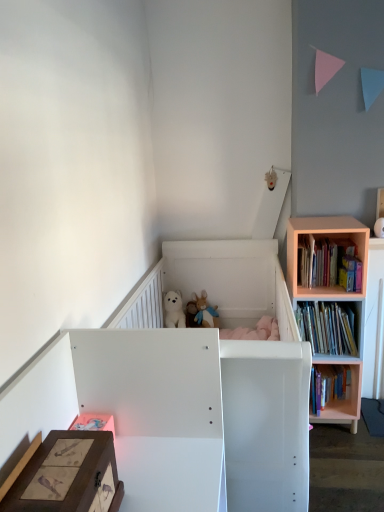
The image size is (384, 512). Describe the element at coordinates (174, 310) in the screenshot. I see `white plush bear at upper center` at that location.

This screenshot has width=384, height=512. What are the coordinates of `wooden bookshelf at right, the 1th book from the top` in the screenshot? It's located at (329, 263).

What do you see at coordinates (332, 300) in the screenshot? The height and width of the screenshot is (512, 384). I see `pink wood bookshelf at right` at bounding box center [332, 300].

The height and width of the screenshot is (512, 384). What do you see at coordinates (329, 386) in the screenshot?
I see `hardcover book at right, arranged as the third book when viewed from the top` at bounding box center [329, 386].

The width and height of the screenshot is (384, 512). Identify the location of matte white vase at upper right, which is the 1th toy from right to left. (379, 227).

Identify the location of white matte infant bed at center. This screenshot has width=384, height=512. (185, 388).

Is white plush bear at upper center behind wooden bookshelf at right, the 1th book from the top?

Yes, white plush bear at upper center is further from the viewer.

Is white plush bear at upper center not within wooden bookshelf at right, the 1th book from the top?

Indeed, white plush bear at upper center is completely outside wooden bookshelf at right, the 1th book from the top.

From the image's perspective, between white plush bear at upper center and wooden bookshelf at right, positioned as the 3th book in bottom-to-top order, who is located below?

white plush bear at upper center appears lower in the image.

Considering the sizes of objects white plush bear at upper center and wooden bookshelf at right, positioned as the 3th book in bottom-to-top order, in the image provided, who is shorter, white plush bear at upper center or wooden bookshelf at right, positioned as the 3th book in bottom-to-top order,?

white plush bear at upper center.

Is wooden bookshelf at right, positioned as the 3th book in bottom-to-top order, positioned with its back to white matte infant bed at center?

wooden bookshelf at right, positioned as the 3th book in bottom-to-top order, is not turned away from white matte infant bed at center.

Which is more to the left, wooden bookshelf at right, the 1th book from the top, or white matte infant bed at center?

Positioned to the left is white matte infant bed at center.

Is wooden bookshelf at right, the 1th book from the top, positioned in front of white matte infant bed at center?

No, wooden bookshelf at right, the 1th book from the top, is further to the viewer.

Is wooden bookshelf at right, the 1th book from the top, located outside white matte infant bed at center?

Absolutely, wooden bookshelf at right, the 1th book from the top, is external to white matte infant bed at center.

Is white matte infant bed at center not close to wooden storage box at lower left?

No, white matte infant bed at center is not far from wooden storage box at lower left.

Is white matte infant bed at center thinner than wooden storage box at lower left?

No.

How many degrees apart are the facing directions of white matte infant bed at center and wooden storage box at lower left?

They differ by 0.506 degrees in their facing directions.

Considering the positions of points (336, 266) and (380, 233), is point (336, 266) farther from camera compared to point (380, 233)?

No, it is not.

Is wooden bookshelf at right, positioned as the 3th book in bottom-to-top order, taller than matte white vase at upper right, the first toy from the front?

Yes.

Is wooden bookshelf at right, positioned as the 3th book in bottom-to-top order, beside matte white vase at upper right, the first toy from the front?

No, wooden bookshelf at right, positioned as the 3th book in bottom-to-top order, is not beside matte white vase at upper right, the first toy from the front.

Is matte white vase at upper right, which ranks as the 1th toy in top-to-bottom order, at the back of wooden bookshelf at right, the 1th book from the top?

That's not correct — wooden bookshelf at right, the 1th book from the top, is not looking away from matte white vase at upper right, which ranks as the 1th toy in top-to-bottom order.

From the image's perspective, which is above, matte white vase at upper right, positioned as the second toy in bottom-to-top order, or wooden storage box at lower left?

matte white vase at upper right, positioned as the second toy in bottom-to-top order, appears higher in the image.

Is matte white vase at upper right, marked as the second toy in a left-to-right arrangement, shorter than wooden storage box at lower left?

Yes.

In the scene shown: Is wooden bookshelf at right, the 1th book from the top, in front of white plush bear at upper center?

Yes, wooden bookshelf at right, the 1th book from the top, is closer to the viewer.

Considering the sizes of wooden bookshelf at right, the 1th book from the top, and white plush bear at upper center in the image, is wooden bookshelf at right, the 1th book from the top, wider or thinner than white plush bear at upper center?

In the image, wooden bookshelf at right, the 1th book from the top, appears to be wider than white plush bear at upper center.

From a real-world perspective, does wooden bookshelf at right, the 1th book from the top, stand above white plush bear at upper center?

Yes.

From the image's perspective, is wooden bookshelf at right, the 1th book from the top, below white plush bear at upper center?

No.

Considering the relative sizes of hardcover book at right, arranged as the third book when viewed from the top, and white matte infant bed at center in the image provided, is hardcover book at right, arranged as the third book when viewed from the top, thinner than white matte infant bed at center?

Yes.

From a real-world perspective, between hardcover book at right, the 1th book from the bottom, and white matte infant bed at center, who is vertically higher?

white matte infant bed at center.

Consider the image. Is the position of hardcover book at right, arranged as the third book when viewed from the top, less distant than that of white matte infant bed at center?

No, hardcover book at right, arranged as the third book when viewed from the top, is further to the viewer.

Is hardcover book at right, the 1th book from the bottom, positioned far away from white matte infant bed at center?

Absolutely, hardcover book at right, the 1th book from the bottom, is distant from white matte infant bed at center.

Image resolution: width=384 pixels, height=512 pixels. I want to click on book that is the 2nd object above the white plush bear at upper center (from a real-world perspective), so click(x=329, y=263).

The width and height of the screenshot is (384, 512). I want to click on infant bed on the left of wooden bookshelf at right, positioned as the 3th book in bottom-to-top order, so click(185, 388).

When comparing their distances from hardcover book at right, arranged as the third book when viewed from the top, does wooden bookshelf at right, the 1th book from the top, or matte white vase at upper right, positioned as the second toy in bottom-to-top order, seem further?

matte white vase at upper right, positioned as the second toy in bottom-to-top order, lies further to hardcover book at right, arranged as the third book when viewed from the top, than the other object.

Looking at the image, which one is located further to wooden bookshelf at right, the 1th book from the top, white plush bear at upper center or fluffy plush toys at center, the first toy when ordered from left to right?

Among the two, white plush bear at upper center is located further to wooden bookshelf at right, the 1th book from the top.

Estimate the real-world distances between objects in this image. Which object is closer to white plush bear at upper center, wooden storage box at lower left or wooden bookshelf at right, the 1th book from the top?

Among the two, wooden bookshelf at right, the 1th book from the top, is located nearer to white plush bear at upper center.

Which object lies nearer to the anchor point wooden bookshelf at right, positioned as the 3th book in bottom-to-top order, hardcover books at right, which is the 2th book from top to bottom, or pink wood bookshelf at right?

pink wood bookshelf at right is closer to wooden bookshelf at right, positioned as the 3th book in bottom-to-top order.

Based on their spatial positions, is pink wood bookshelf at right or white plush bear at upper center further from hardcover book at right, arranged as the third book when viewed from the top?

white plush bear at upper center lies further to hardcover book at right, arranged as the third book when viewed from the top, than the other object.

Considering their positions, is hardcover book at right, the 1th book from the bottom, positioned further to hardcover books at right, which is the 2th book from top to bottom, than fluffy plush toys at center, the first toy when ordered from left to right?

fluffy plush toys at center, the first toy when ordered from left to right.

Based on their spatial positions, is pink wood bookshelf at right or wooden storage box at lower left closer to white matte infant bed at center?

wooden storage box at lower left is positioned closer to the anchor white matte infant bed at center.

Considering their positions, is fluffy plush toys at center, placed as the first toy when sorted from back to front, positioned closer to wooden storage box at lower left than white matte infant bed at center?

white matte infant bed at center is closer to wooden storage box at lower left.

This screenshot has width=384, height=512. I want to click on shelf between wooden storage box at lower left and hardcover books at right, the 2th book ordered from the bottom, in the front-back direction, so click(x=332, y=300).

Find the location of `infant bed between wooden storage box at lower left and pink wood bookshelf at right in the front-back direction`. infant bed between wooden storage box at lower left and pink wood bookshelf at right in the front-back direction is located at coordinates (185, 388).

Identify the location of book between white matte infant bed at center and hardcover books at right, the 2th book ordered from the bottom, from front to back. The width and height of the screenshot is (384, 512). (329, 263).

Where is `infant bed between wooden storage box at lower left and hardcover books at right, which is the 2th book from top to bottom, in the front-back direction`? This screenshot has width=384, height=512. infant bed between wooden storage box at lower left and hardcover books at right, which is the 2th book from top to bottom, in the front-back direction is located at coordinates (185, 388).